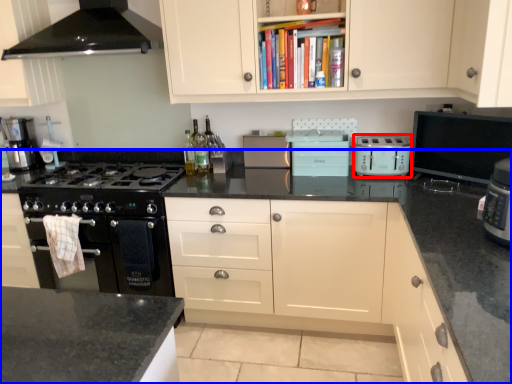
Question: Which of the following is the closest to the observer, kitchen appliance (highlighted by a red box) or countertop (highlighted by a blue box)?

Choices:
 (A) kitchen appliance
 (B) countertop

Answer: (B)